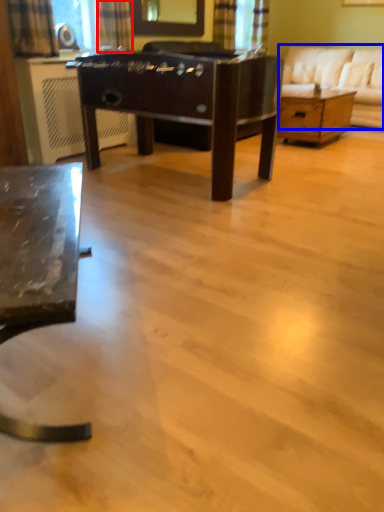
Question: Which object is further to the camera taking this photo, curtain (highlighted by a red box) or studio couch (highlighted by a blue box)?

Choices:
 (A) curtain
 (B) studio couch

Answer: (B)